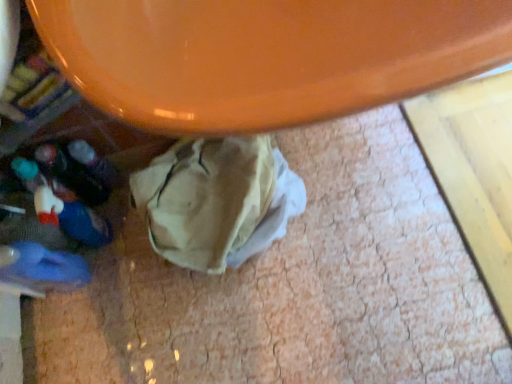
The image size is (512, 384). Identify the location of vacant space to the right of blue rubber slipper at lower left. (133, 279).